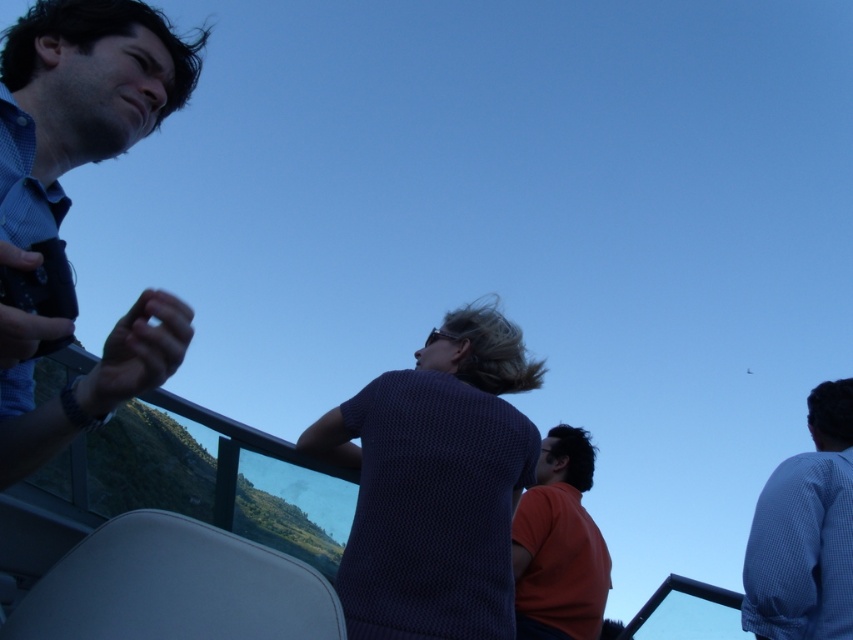
Question: Considering the real-world distances, which object is farthest from the orange matte shirt at center?

Choices:
 (A) dark blue textured shirt at center
 (B) blue checkered shirt at upper right

Answer: (A)

Question: Considering the relative positions of blue checkered shirt at upper left and blue checkered shirt at upper right in the image provided, where is blue checkered shirt at upper left located with respect to blue checkered shirt at upper right?

Choices:
 (A) right
 (B) left

Answer: (B)

Question: Considering the real-world distances, which object is farthest from the blue checkered shirt at upper right?

Choices:
 (A) orange matte shirt at center
 (B) dark blue textured shirt at center

Answer: (B)

Question: Considering the relative positions of dark blue textured shirt at center and orange matte shirt at center in the image provided, where is dark blue textured shirt at center located with respect to orange matte shirt at center?

Choices:
 (A) below
 (B) above

Answer: (B)

Question: Considering the relative positions of blue checkered shirt at upper left and blue checkered shirt at upper right in the image provided, where is blue checkered shirt at upper left located with respect to blue checkered shirt at upper right?

Choices:
 (A) below
 (B) above

Answer: (B)

Question: Which point is closer to the camera?

Choices:
 (A) (833, 577)
 (B) (166, 358)
 (C) (393, 532)
 (D) (543, 561)

Answer: (B)